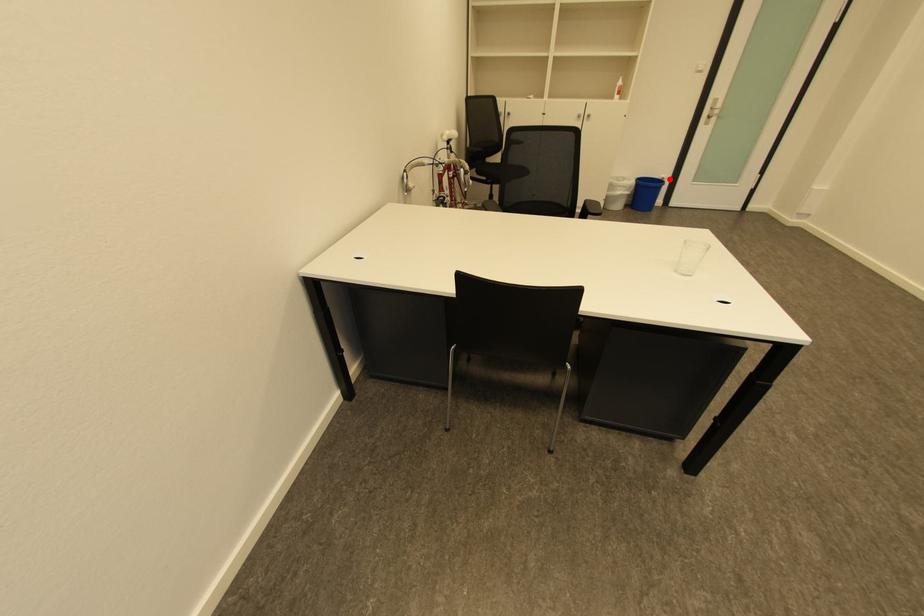
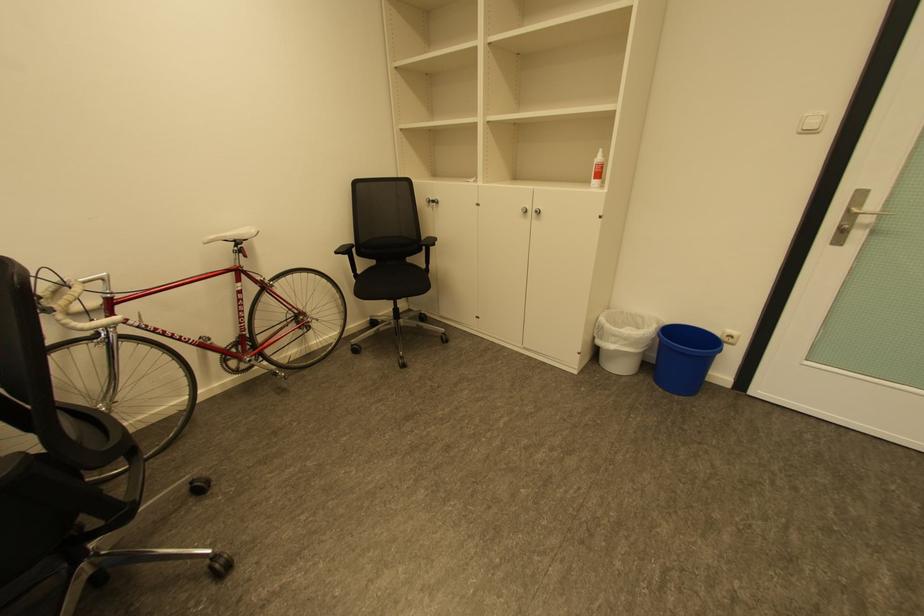
Question: I am providing you with two images of the same scene from different viewpoints. Image1 has a red point marked. In image2, the corresponding 3D location appears at what relative position? Reply with the corresponding letter.

Choices:
 (A) Closer
 (B) Farther

Answer: (B)